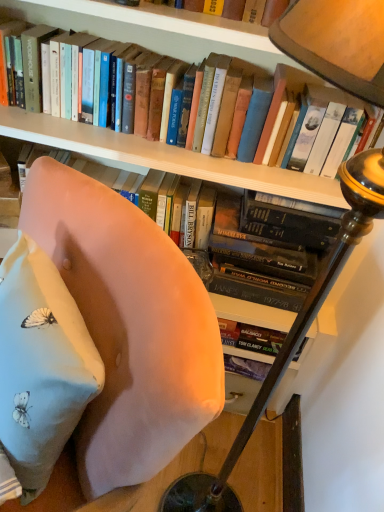
Question: From a real-world perspective, is light pink fabric pillow at lower left physically below hardcover book at upper center?

Choices:
 (A) yes
 (B) no

Answer: (A)

Question: Is light pink fabric pillow at lower left completely or partially outside of hardcover book at upper center?

Choices:
 (A) yes
 (B) no

Answer: (A)

Question: Is light pink fabric pillow at lower left positioned with its back to hardcover book at upper center?

Choices:
 (A) yes
 (B) no

Answer: (B)

Question: Is light pink fabric pillow at lower left with hardcover book at upper center?

Choices:
 (A) no
 (B) yes

Answer: (A)

Question: Can you confirm if light pink fabric pillow at lower left is shorter than hardcover book at upper center?

Choices:
 (A) yes
 (B) no

Answer: (B)

Question: Considering the relative sizes of light pink fabric pillow at lower left and hardcover book at upper center in the image provided, is light pink fabric pillow at lower left bigger than hardcover book at upper center?

Choices:
 (A) yes
 (B) no

Answer: (B)

Question: Considering the relative sizes of hardcover book at upper center and wooden table lamp at upper right in the image provided, is hardcover book at upper center bigger than wooden table lamp at upper right?

Choices:
 (A) yes
 (B) no

Answer: (B)

Question: Is hardcover book at upper center behind wooden table lamp at upper right?

Choices:
 (A) yes
 (B) no

Answer: (A)

Question: Does hardcover book at upper center have a lesser height compared to wooden table lamp at upper right?

Choices:
 (A) no
 (B) yes

Answer: (B)

Question: Is wooden table lamp at upper right inside hardcover book at upper center?

Choices:
 (A) no
 (B) yes

Answer: (A)

Question: Is hardcover book at upper center at the right side of wooden table lamp at upper right?

Choices:
 (A) yes
 (B) no

Answer: (B)

Question: Is hardcover book at upper center turned away from wooden table lamp at upper right?

Choices:
 (A) no
 (B) yes

Answer: (A)

Question: Is light pink fabric pillow at lower left turned away from wooden table lamp at upper right?

Choices:
 (A) yes
 (B) no

Answer: (A)